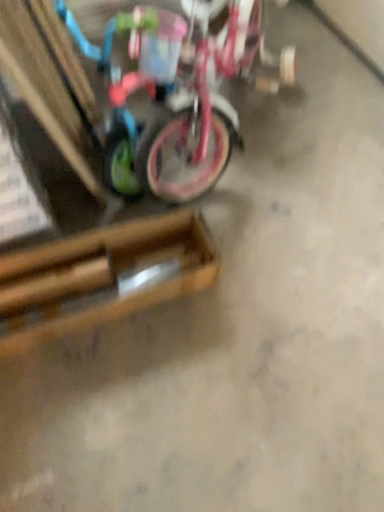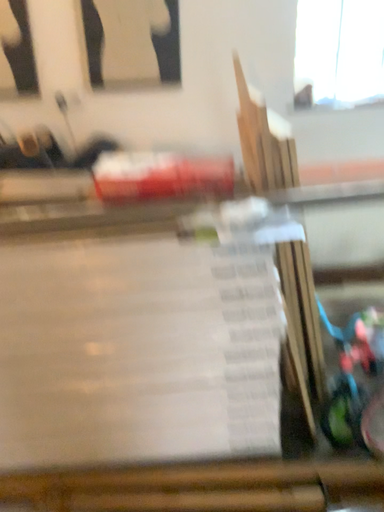
Question: How did the camera likely rotate when shooting the video?

Choices:
 (A) rotated upward
 (B) rotated downward

Answer: (A)